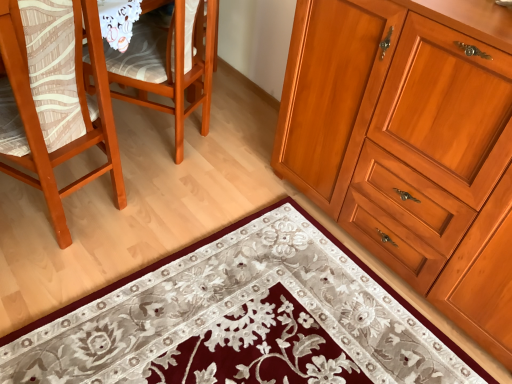
Locate an element on the screen. The width and height of the screenshot is (512, 384). vacant area that is situated to the right of wooden chair at left, placed as the 2th chair when sorted from left to right is located at coordinates (234, 156).